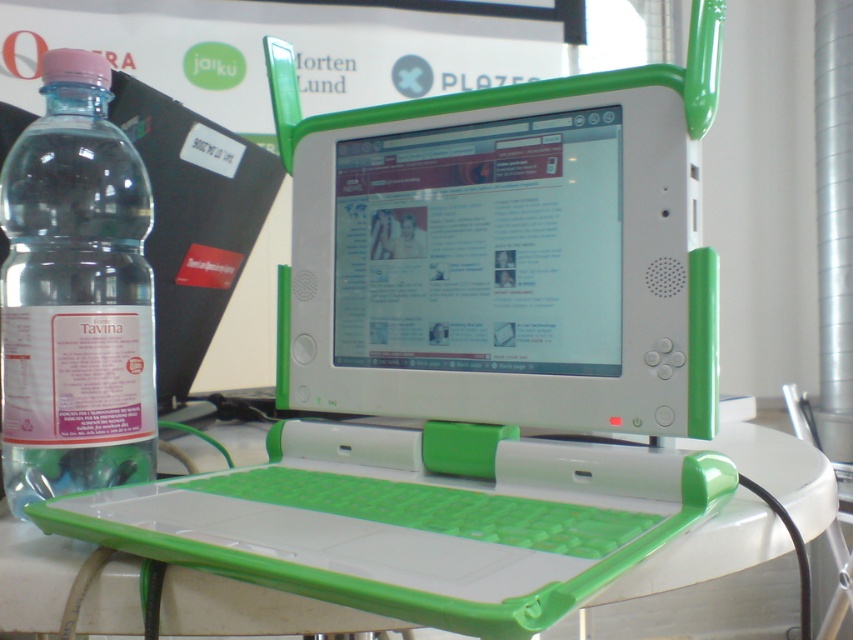
Can you confirm if clear plastic bottle at left is positioned below white plastic table at center?

Actually, clear plastic bottle at left is above white plastic table at center.

Is point (73, 52) closer to viewer compared to point (30, 556)?

That is False.

What are the coordinates of `clear plastic bottle at left` in the screenshot? It's located at (74, 294).

Between green plastic computer monitor at center and clear plastic bottle at left, which one is positioned higher?

Positioned higher is green plastic computer monitor at center.

Is point (604, 374) more distant than point (56, 100)?

No, (604, 374) is in front of (56, 100).

Identify the location of green plastic computer monitor at center. (503, 256).

Is point (619, 68) positioned behind point (202, 465)?

No, it is in front of (202, 465).

Does green plastic computer monitor at center appear on the left side of white plastic table at center?

No, green plastic computer monitor at center is not to the left of white plastic table at center.

Find the location of `green plastic computer monitor at center`. green plastic computer monitor at center is located at coordinates (503, 256).